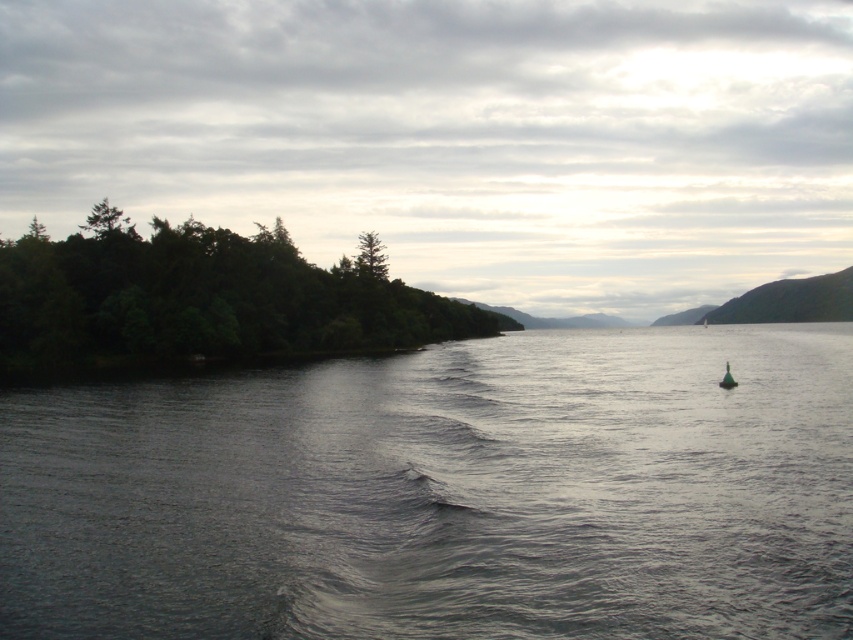
Who is more distant from viewer, (654,600) or (247,264)?

The point (247,264) is more distant.

Where is `dark gray water at center`? The height and width of the screenshot is (640, 853). dark gray water at center is located at coordinates (445, 493).

Measure the distance between dark gray water at center and green matte buoy at lower right.

dark gray water at center is 28.79 meters away from green matte buoy at lower right.

Is point (262, 481) positioned behind point (724, 365)?

No, (262, 481) is in front of (724, 365).

Image resolution: width=853 pixels, height=640 pixels. Describe the element at coordinates (445, 493) in the screenshot. I see `dark gray water at center` at that location.

This screenshot has height=640, width=853. Find the location of `dark gray water at center`. dark gray water at center is located at coordinates (445, 493).

Image resolution: width=853 pixels, height=640 pixels. Describe the element at coordinates (202, 300) in the screenshot. I see `green leafy trees at left` at that location.

Which is above, green leafy trees at left or green matte buoy at lower right?

Positioned higher is green leafy trees at left.

The height and width of the screenshot is (640, 853). Describe the element at coordinates (202, 300) in the screenshot. I see `green leafy trees at left` at that location.

Where is `green leafy trees at left`? This screenshot has height=640, width=853. green leafy trees at left is located at coordinates (202, 300).